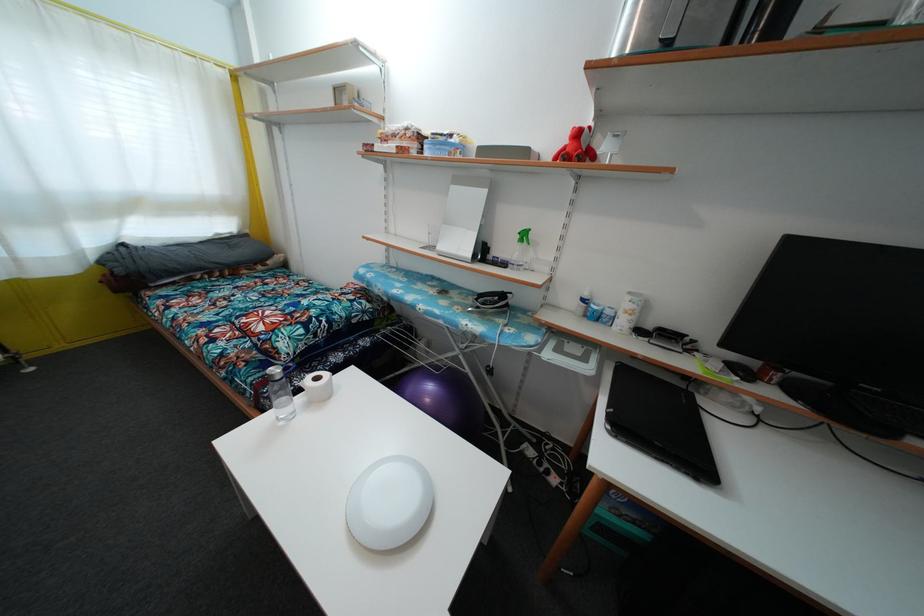
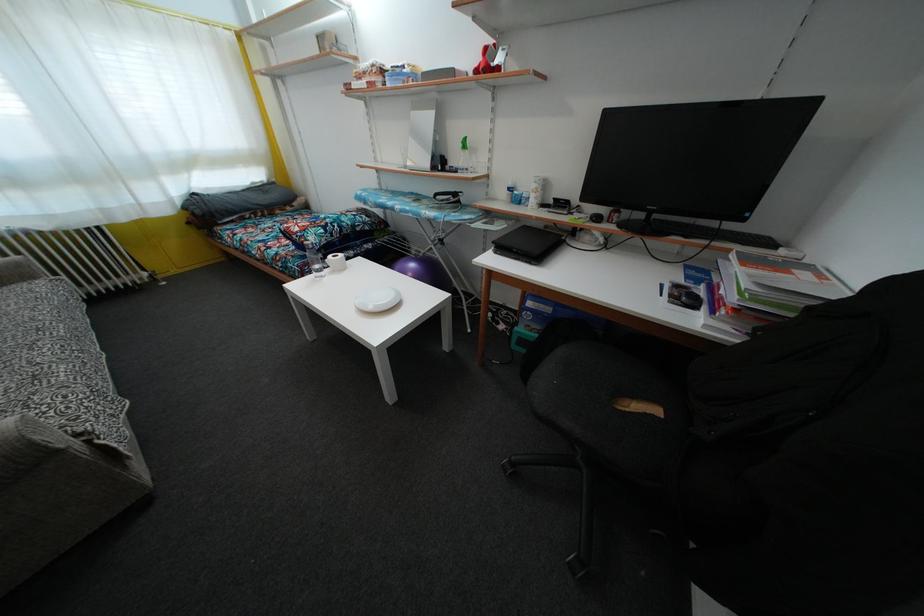
In the second image, find the point that corresponds to (x=523, y=253) in the first image.

(467, 160)